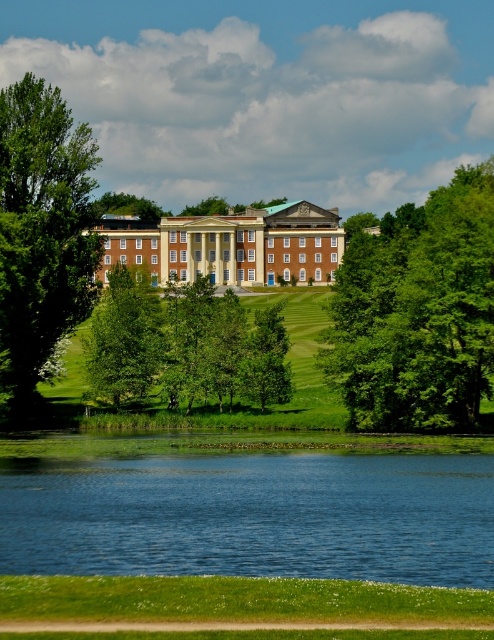
Looking at this image, does green leafy tree at center-right have a greater width compared to brick building at center?

Incorrect, green leafy tree at center-right's width does not surpass brick building at center's.

Between point (467, 189) and point (318, 253), which one is positioned behind?

Positioned behind is point (318, 253).

Locate an element on the screen. green leafy tree at center-right is located at coordinates coord(418,312).

Measure the distance between point (326, 282) and camera.

They are 180.19 meters apart.

Can you confirm if brick building at center is positioned above green leafy tree at lower left?

Correct, brick building at center is located above green leafy tree at lower left.

Does point (294, 243) lie behind point (126, 296)?

Yes.

Locate an element on the screen. The height and width of the screenshot is (640, 494). brick building at center is located at coordinates (229, 244).

Is green leafy tree at center below brick building at center?

Yes, green leafy tree at center is below brick building at center.

Is point (146, 364) closer to camera compared to point (301, 228)?

Yes, it is in front of point (301, 228).

The width and height of the screenshot is (494, 640). I want to click on green leafy tree at center, so click(183, 344).